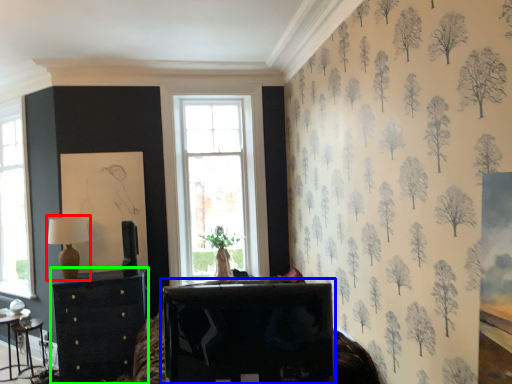
Question: Which is nearer to the table lamp (highlighted by a red box)? table (highlighted by a blue box) or chest of drawers (highlighted by a green box).

Choices:
 (A) table
 (B) chest of drawers

Answer: (B)